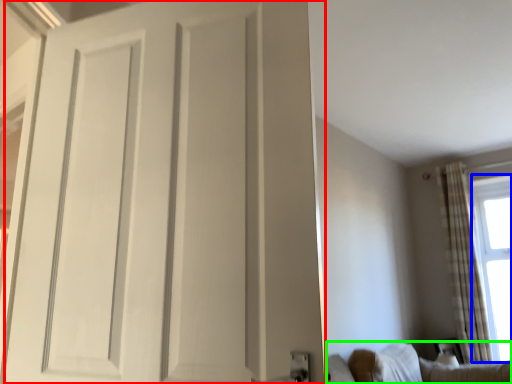
Question: Which is nearer to the door (highlighted by a red box)? window screen (highlighted by a blue box) or furniture (highlighted by a green box).

Choices:
 (A) window screen
 (B) furniture

Answer: (B)